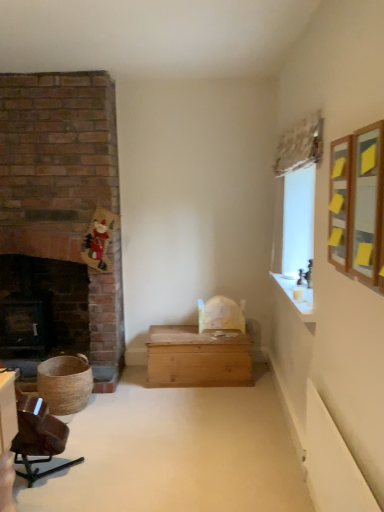
I want to click on free location in front of wooden chest at center, so click(223, 406).